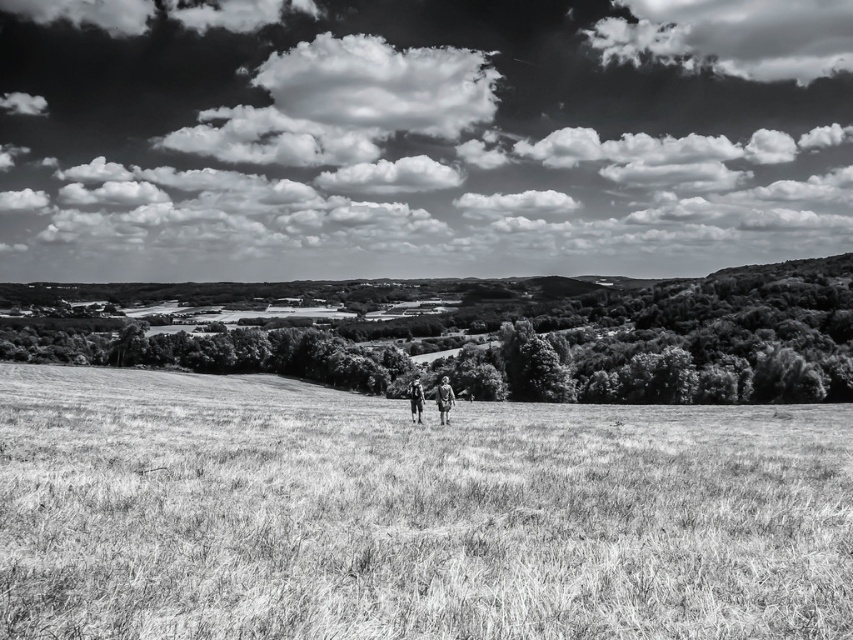
Question: Which object appears closest to the camera in this image?

Choices:
 (A) wooden figure at center
 (B) camouflage fabric person at center

Answer: (A)

Question: Which of the following is the farthest from the observer?

Choices:
 (A) grassy at center
 (B) camouflage fabric person at center

Answer: (B)

Question: Is grassy at center to the left of camouflage fabric person at center from the viewer's perspective?

Choices:
 (A) no
 (B) yes

Answer: (B)

Question: In this image, where is grassy at center located relative to camouflage fabric person at center?

Choices:
 (A) above
 (B) below

Answer: (A)

Question: Is grassy at center to the left of wooden figure at center from the viewer's perspective?

Choices:
 (A) no
 (B) yes

Answer: (B)

Question: Which of the following is the closest to the observer?

Choices:
 (A) grassy at center
 (B) camouflage fabric person at center
 (C) wooden figure at center

Answer: (A)